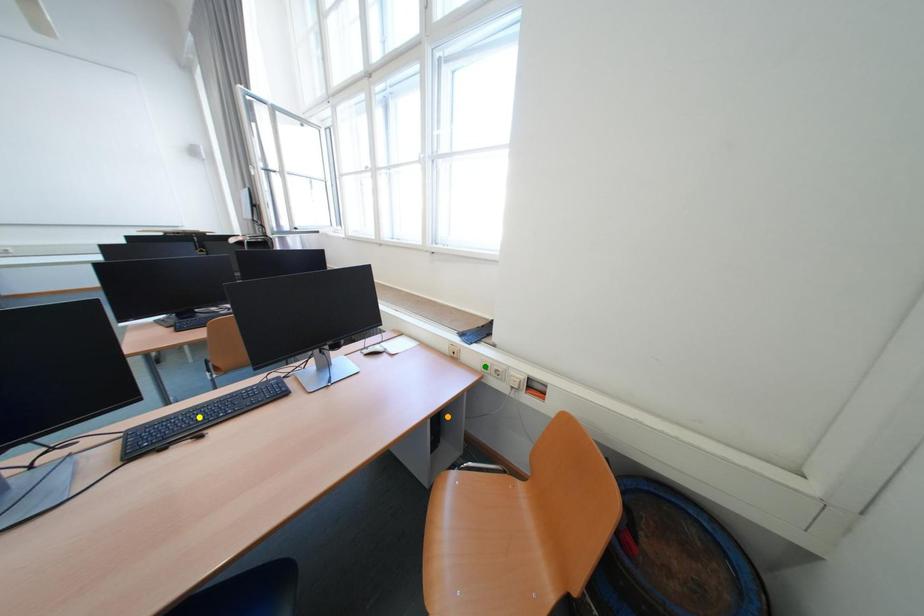
Order these from nearest to farthest:
A) orange point
B) green point
C) yellow point

yellow point → green point → orange point